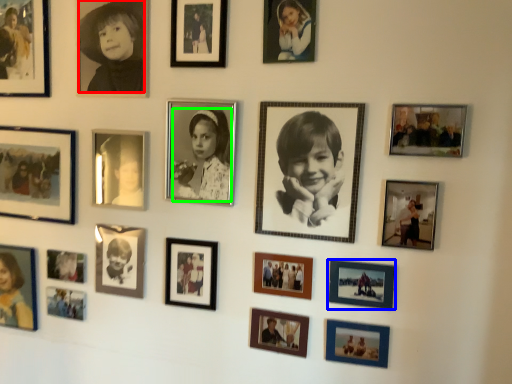
Question: Estimate the real-world distances between objects in this image. Which object is farther from person (highlighted by a red box), picture frame (highlighted by a blue box) or person (highlighted by a green box)?

Choices:
 (A) picture frame
 (B) person

Answer: (A)